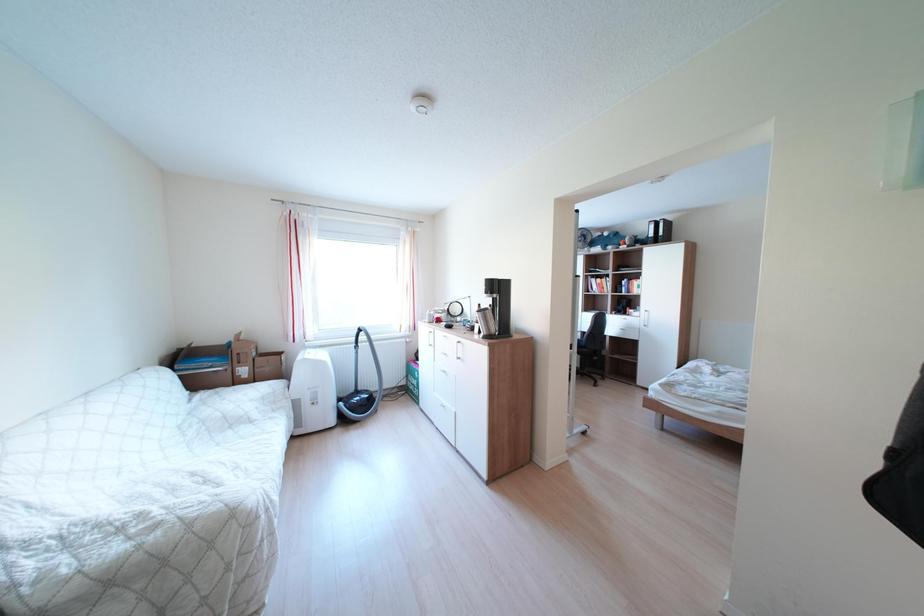
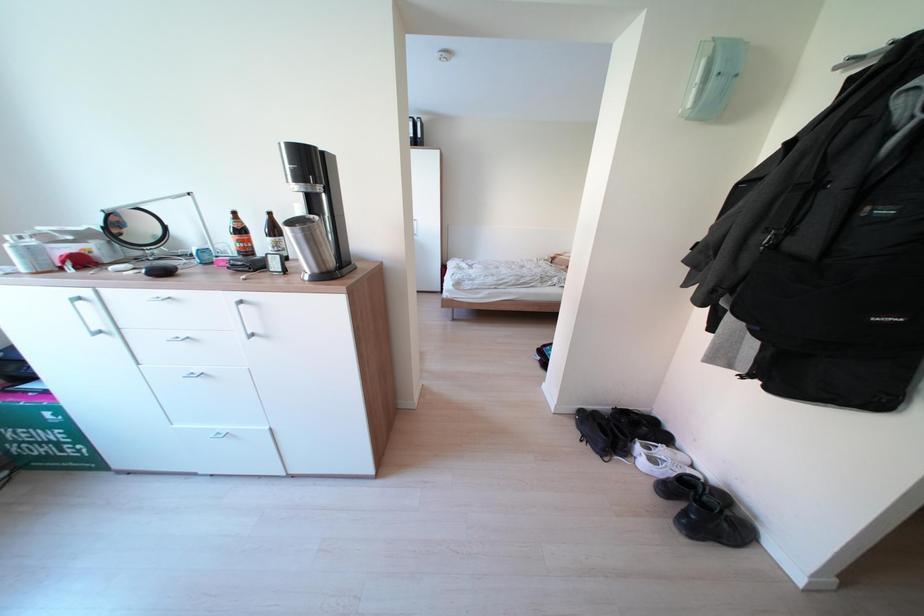
First-person continuous shooting, in which direction is the camera rotating?

The rotation direction of the camera is right-down.